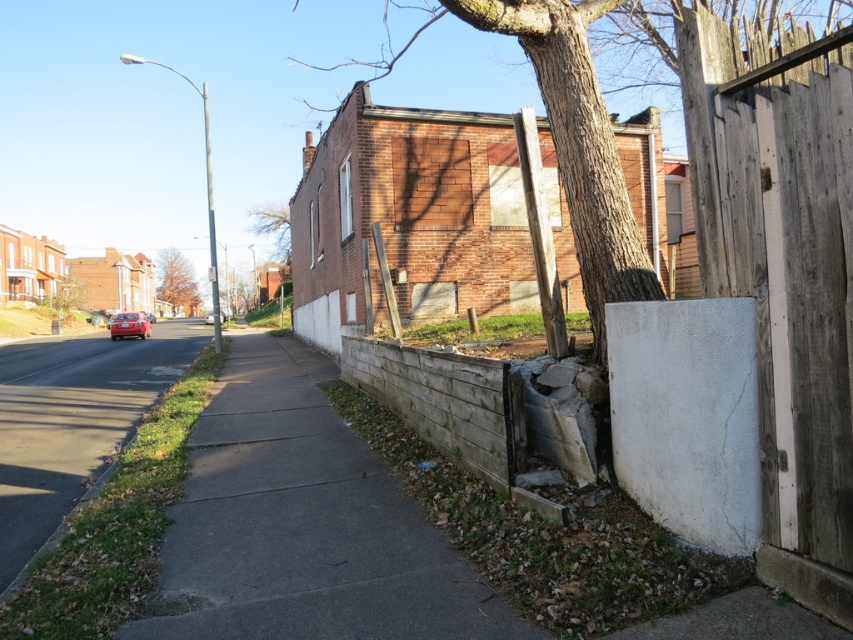
You are a delivery person trying to reach the weathered wood gate at right. You are currently standing on the green asphalt sidewalk at lower left. Which direction should you move to get closer to the gate?

Since the weathered wood gate at right is closer to the viewer than the green asphalt sidewalk at lower left, you should move towards the right side of the image to reach the gate.

You are a delivery person trying to reach a house located behind the weathered wood gate at right. You are currently standing on the green asphalt sidewalk at lower left. Which direction should you walk to reach the gate?

The weathered wood gate at right is above the green asphalt sidewalk at lower left, so you should walk upward along the sidewalk to reach the gate.

You are a city planner analyzing this street scene. The brown textured tree at upper center is located at coordinates 0.441, 0.208. If you were to place a new bench exactly halfway between the tree and the streetlamp, where would the bench be positioned?

The bench would be positioned at coordinates halfway between the brown textured tree at upper center at (177, 282) and the streetlamp. However, the exact coordinates of the streetlamp are not provided in the given information, so the exact midpoint cannot be calculated without additional data.